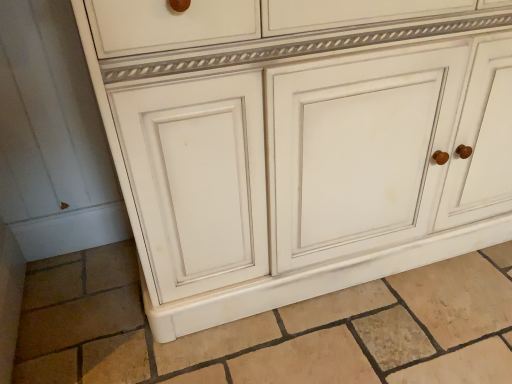
You are a GUI agent. You are given a task and a screenshot of the screen. Output one action in this format:
    pyautogui.click(x=<x>, y=<y>)
    Task: Click on the beige stone tile at lower center
    
    Given the screenshot: What is the action you would take?
    point(271,328)

Describe the element at coordinates (271, 328) in the screenshot. I see `beige stone tile at lower center` at that location.

Identify the location of beige stone tile at lower center. This screenshot has height=384, width=512. (271, 328).